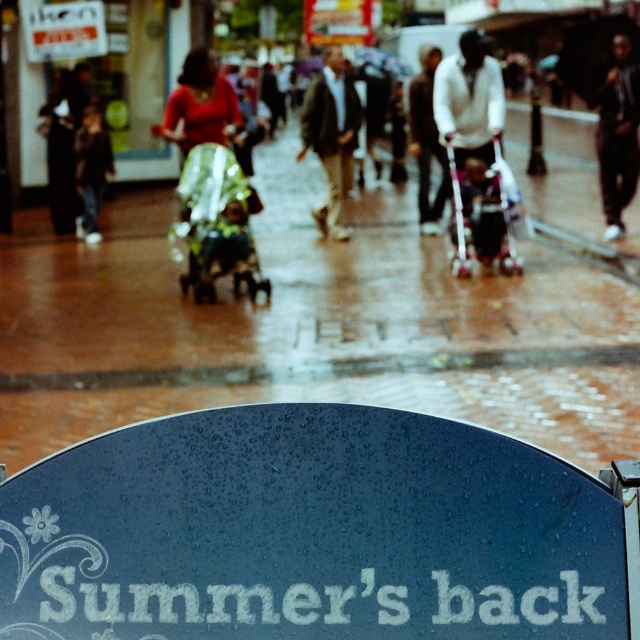
Question: Which of the following is the closest to the observer?

Choices:
 (A) white sweater at center
 (B) dark blue textured sign at lower center
 (C) dark brown leather jacket at center

Answer: (B)

Question: Is white sweater at center positioned before dark brown leather jacket at center?

Choices:
 (A) yes
 (B) no

Answer: (A)

Question: Is white textured sign at bottom positioned at the back of matte red shirt at center?

Choices:
 (A) no
 (B) yes

Answer: (A)

Question: Which point is farther from the camera taking this photo?

Choices:
 (A) (488, 141)
 (B) (109, 632)
 (C) (339, 598)

Answer: (A)

Question: Estimate the real-world distances between objects in this image. Which object is closer to the dark brown leather jacket at center?

Choices:
 (A) white textured sign at bottom
 (B) dark blue textured sign at lower center
 (C) black leather jacket at upper right

Answer: (C)

Question: Is white sweater at center closer to camera compared to dark gray sweater at center?

Choices:
 (A) yes
 (B) no

Answer: (A)